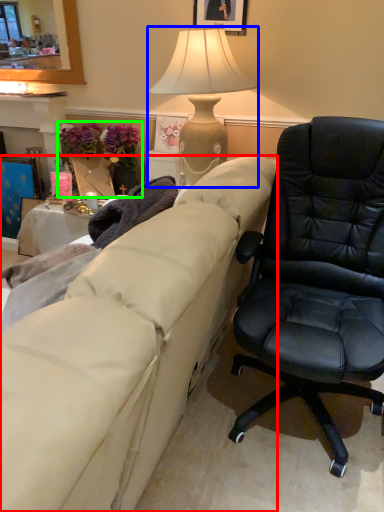
Question: Which is farther away from studio couch (highlighted by a red box)? lamp (highlighted by a blue box) or houseplant (highlighted by a green box)?

Choices:
 (A) lamp
 (B) houseplant

Answer: (B)